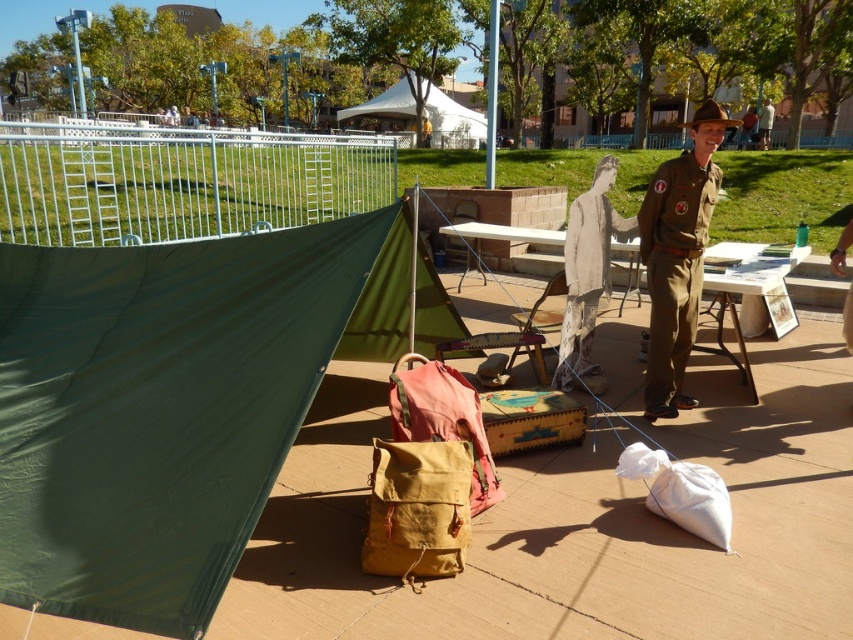
Which is in front, point (102, 579) or point (432, 420)?

Positioned in front is point (102, 579).

Measure the distance between green canvas tent at left and camera.

green canvas tent at left is 2.09 meters from camera.

In order to click on green canvas tent at left in this screenshot , I will do `click(170, 404)`.

Does white paper figure at center come behind wooden picnic table at center?

Yes, it is.

The width and height of the screenshot is (853, 640). Find the location of `white paper figure at center`. white paper figure at center is located at coordinates (587, 275).

Find the location of a particular element. This screenshot has width=853, height=640. white paper figure at center is located at coordinates (587, 275).

Does brown uniform at center appear on the right side of white paper figure at center?

Indeed, brown uniform at center is positioned on the right side of white paper figure at center.

Which is behind, point (669, 170) or point (611, 168)?

The point (611, 168) is more distant.

The width and height of the screenshot is (853, 640). In order to click on brown uniform at center in this screenshot , I will do `click(677, 257)`.